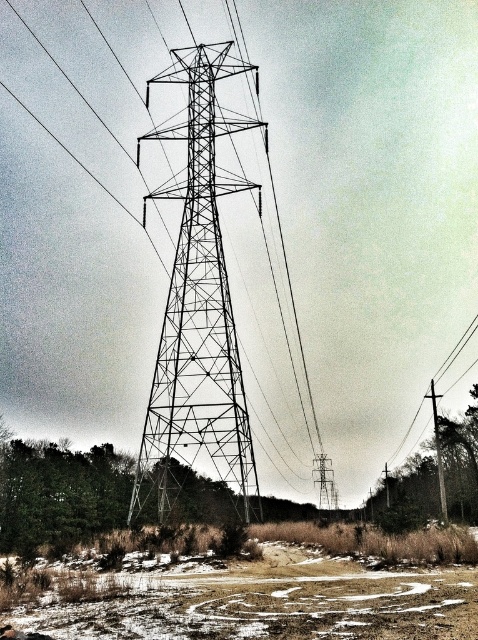
Question: Which object is positioned closest to the brown grass at lower center?

Choices:
 (A) metallic wire at right
 (B) metallic wireframe tower at center

Answer: (B)

Question: Does brown grass at lower center appear on the left side of metallic wireframe tower at center?

Choices:
 (A) no
 (B) yes

Answer: (A)

Question: Does brown grass at lower center have a lesser width compared to metallic wire at right?

Choices:
 (A) no
 (B) yes

Answer: (A)

Question: Which point is closer to the camera?

Choices:
 (A) metallic wire at right
 (B) brown grass at lower center

Answer: (B)

Question: Which object appears farthest from the camera in this image?

Choices:
 (A) brown grass at lower center
 (B) metallic wireframe tower at center
 (C) metallic wire at right

Answer: (C)

Question: From the image, what is the correct spatial relationship of metallic wireframe tower at center in relation to metallic wire at right?

Choices:
 (A) right
 (B) left

Answer: (B)